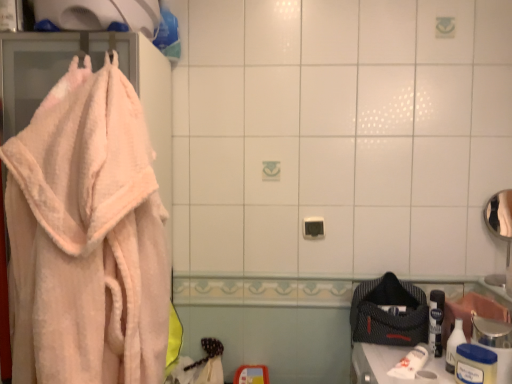
Locate an element on the screen. Image resolution: width=512 pixels, height=384 pixels. white plastic container at lower right, the 2th toiletry from the back is located at coordinates (475, 365).

Measure the distance between white plastic bottle at lower right, which is the 2th toiletry from front to back, and white matte toilet paper at lower right.

white plastic bottle at lower right, which is the 2th toiletry from front to back, is 4.69 inches from white matte toilet paper at lower right.

Which of these two, white plastic bottle at lower right, the 1th toiletry when ordered from back to front, or white matte toilet paper at lower right, stands shorter?

white matte toilet paper at lower right is shorter.

From a real-world perspective, is white plastic bottle at lower right, the 1th toiletry when ordered from back to front, located higher than white matte toilet paper at lower right?

Correct, in the physical world, white plastic bottle at lower right, the 1th toiletry when ordered from back to front, is higher than white matte toilet paper at lower right.

From the image's perspective, which one is positioned higher, white plastic bottle at lower right, which is the 2th toiletry from front to back, or white matte toilet paper at lower right?

white plastic bottle at lower right, which is the 2th toiletry from front to back, is shown above in the image.

From a real-world perspective, is peachy soft towel at left positioned over white plastic container at lower right, which is the first toiletry from front to back, based on gravity?

Yes.

Is point (24, 290) closer or farther from the camera than point (490, 355)?

Clearly, point (24, 290) is closer to the camera than point (490, 355).

Is peachy soft towel at left inside the boundaries of white plastic container at lower right, the 2th toiletry from the back, or outside?

peachy soft towel at left lies outside white plastic container at lower right, the 2th toiletry from the back.

Are peachy soft towel at left and white plastic container at lower right, which is the first toiletry from front to back, located far from each other?

That's right, there is a large distance between peachy soft towel at left and white plastic container at lower right, which is the first toiletry from front to back.

Is white matte toilet paper at lower right next to white plastic container at lower right, the 2th toiletry from the back, and touching it?

No.

From the image's perspective, which one is positioned higher, white matte toilet paper at lower right or white plastic container at lower right, the 2th toiletry from the back?

white plastic container at lower right, the 2th toiletry from the back, is shown above in the image.

From the picture: Looking at the image, does white matte toilet paper at lower right seem bigger or smaller compared to white plastic container at lower right, the 2th toiletry from the back?

Considering their sizes, white matte toilet paper at lower right takes up less space than white plastic container at lower right, the 2th toiletry from the back.

Is white matte toilet paper at lower right to the left or to the right of white plastic container at lower right, which is the first toiletry from front to back, in the image?

From the image, it's evident that white matte toilet paper at lower right is to the left of white plastic container at lower right, which is the first toiletry from front to back.

What's the angular difference between white plastic container at lower right, which is the first toiletry from front to back, and white plastic bottle at lower right, the 1th toiletry when ordered from back to front,'s facing directions?

There is a 7.29e-05-degree angle between the facing directions of white plastic container at lower right, which is the first toiletry from front to back, and white plastic bottle at lower right, the 1th toiletry when ordered from back to front.

Which is in front, white plastic container at lower right, which is the first toiletry from front to back, or white plastic bottle at lower right, which is the 2th toiletry from front to back?

white plastic container at lower right, which is the first toiletry from front to back, is closer to the camera.

Which of these two, white plastic container at lower right, the 2th toiletry from the back, or white plastic bottle at lower right, the 1th toiletry when ordered from back to front, is smaller?

white plastic bottle at lower right, the 1th toiletry when ordered from back to front.

At what (x,y) coordinates should I click in order to perform the action: click on toiletry on the left of white plastic container at lower right, the 2th toiletry from the back. Please return your answer as a coordinate pair (x, y). Looking at the image, I should click on (454, 345).

Consider the image. From a real-world perspective, who is located higher, white plastic container at lower right, which is the first toiletry from front to back, or white matte toilet paper at lower right?

white plastic container at lower right, which is the first toiletry from front to back, from a real-world perspective.

Based on their positions, is white plastic container at lower right, the 2th toiletry from the back, located to the left or right of white matte toilet paper at lower right?

In the image, white plastic container at lower right, the 2th toiletry from the back, appears on the right side of white matte toilet paper at lower right.

Is white plastic container at lower right, which is the first toiletry from front to back, not near white matte toilet paper at lower right?

Actually, white plastic container at lower right, which is the first toiletry from front to back, and white matte toilet paper at lower right are a little close together.

Is point (489, 376) closer or farther from the camera than point (410, 358)?

Point (489, 376) is positioned closer to the camera compared to point (410, 358).

Considering the points (399, 372) and (47, 382), which point is in front, point (399, 372) or point (47, 382)?

The point (47, 382) is in front.

Is white matte toilet paper at lower right bigger than peachy soft towel at left?

Actually, white matte toilet paper at lower right might be smaller than peachy soft towel at left.

Can you confirm if white matte toilet paper at lower right is positioned to the left of peachy soft towel at left?

Incorrect, white matte toilet paper at lower right is not on the left side of peachy soft towel at left.

Between white matte toilet paper at lower right and peachy soft towel at left, which one has larger width?

Wider between the two is peachy soft towel at left.

Which of these two, peachy soft towel at left or white matte toilet paper at lower right, is wider?

peachy soft towel at left is wider.

From a real-world perspective, is peachy soft towel at left on top of white matte toilet paper at lower right?

Yes, from a real-world perspective, peachy soft towel at left is above white matte toilet paper at lower right.

From the image's perspective, is peachy soft towel at left beneath white matte toilet paper at lower right?

Incorrect, from the image's perspective, peachy soft towel at left is higher than white matte toilet paper at lower right.

Identify the location of the 1st toiletry to the right when counting from the white matte toilet paper at lower right. (454, 345).

I want to click on toiletry that is the 1st one when counting backward from the peachy soft towel at left, so click(x=475, y=365).

From the image, which object appears to be nearer to white plastic bottle at lower right, the 1th toiletry when ordered from back to front, peachy soft towel at left or white plastic container at lower right, the 2th toiletry from the back?

white plastic container at lower right, the 2th toiletry from the back, lies closer to white plastic bottle at lower right, the 1th toiletry when ordered from back to front, than the other object.

When comparing their distances from white plastic bottle at lower right, the 1th toiletry when ordered from back to front, does white plastic container at lower right, the 2th toiletry from the back, or white matte toilet paper at lower right seem further?

white matte toilet paper at lower right is further to white plastic bottle at lower right, the 1th toiletry when ordered from back to front.

Based on the photo, considering their positions, is white plastic container at lower right, which is the first toiletry from front to back, positioned further to white matte toilet paper at lower right than peachy soft towel at left?

peachy soft towel at left lies further to white matte toilet paper at lower right than the other object.

Which object lies nearer to the anchor point peachy soft towel at left, white plastic bottle at lower right, the 1th toiletry when ordered from back to front, or white plastic container at lower right, the 2th toiletry from the back?

The object closer to peachy soft towel at left is white plastic container at lower right, the 2th toiletry from the back.

Considering their positions, is peachy soft towel at left positioned further to white matte toilet paper at lower right than white plastic bottle at lower right, the 1th toiletry when ordered from back to front?

Among the two, peachy soft towel at left is located further to white matte toilet paper at lower right.

Based on their spatial positions, is white plastic container at lower right, which is the first toiletry from front to back, or white plastic bottle at lower right, which is the 2th toiletry from front to back, further from white matte toilet paper at lower right?

white plastic container at lower right, which is the first toiletry from front to back, is positioned further to the anchor white matte toilet paper at lower right.

Which object lies further to the anchor point peachy soft towel at left, white matte toilet paper at lower right or white plastic bottle at lower right, the 1th toiletry when ordered from back to front?

white plastic bottle at lower right, the 1th toiletry when ordered from back to front, is further to peachy soft towel at left.

Considering their positions, is white plastic container at lower right, which is the first toiletry from front to back, positioned further to peachy soft towel at left than white plastic bottle at lower right, the 1th toiletry when ordered from back to front?

white plastic bottle at lower right, the 1th toiletry when ordered from back to front, lies further to peachy soft towel at left than the other object.

The height and width of the screenshot is (384, 512). I want to click on toilet paper between peachy soft towel at left and white plastic container at lower right, which is the first toiletry from front to back, so click(410, 363).

The width and height of the screenshot is (512, 384). In order to click on toiletry situated between peachy soft towel at left and white plastic container at lower right, which is the first toiletry from front to back, from left to right in this screenshot , I will do `click(454, 345)`.

You are a GUI agent. You are given a task and a screenshot of the screen. Output one action in this format:
    pyautogui.click(x=<x>, y=<y>)
    Task: Click on the toiletry between white matte toilet paper at lower right and white plastic container at lower right, the 2th toiletry from the back, from left to right
    This screenshot has width=512, height=384.
    Given the screenshot: What is the action you would take?
    pyautogui.click(x=454, y=345)

Identify the location of toilet paper located between peachy soft towel at left and white plastic bottle at lower right, the 1th toiletry when ordered from back to front, in the left-right direction. (410, 363).